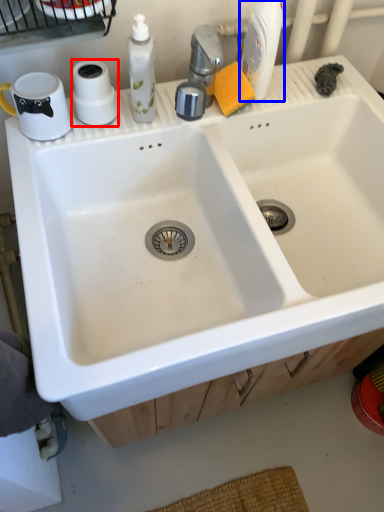
Question: Which object appears closest to the camera in this image, toilet paper (highlighted by a red box) or cleaning product (highlighted by a blue box)?

Choices:
 (A) toilet paper
 (B) cleaning product

Answer: (B)